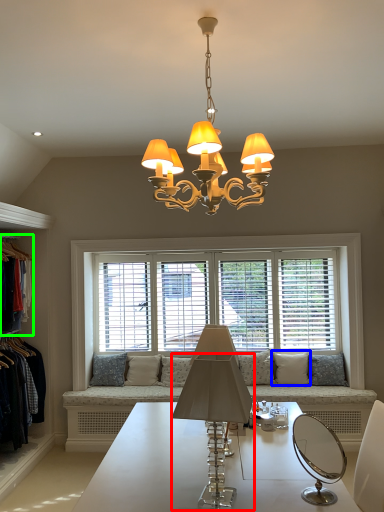
Question: Based on their relative distances, which object is nearer to lamp (highlighted by a red box)? Choose from pillow (highlighted by a blue box) and clothing (highlighted by a green box).

Choices:
 (A) pillow
 (B) clothing

Answer: (B)